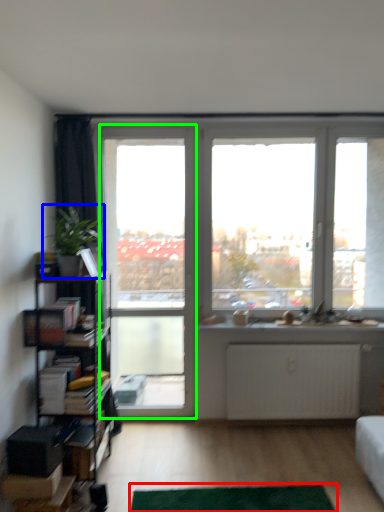
Question: Estimate the real-world distances between objects in this image. Which object is closer to flat (highlighted by a red box), houseplant (highlighted by a blue box) or screen door (highlighted by a green box)?

Choices:
 (A) houseplant
 (B) screen door

Answer: (A)